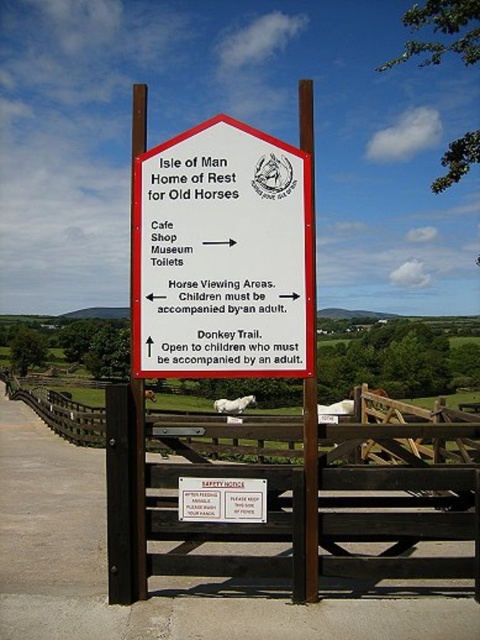
Can you confirm if white paper sign at center is positioned below white plastic sign at center?

No.

Which is in front, point (302, 307) or point (182, 516)?

Point (302, 307)

Where is `white paper sign at center`? white paper sign at center is located at coordinates (222, 256).

Consider the image. Is white paper sign at center to the right of wooden fence at center from the viewer's perspective?

Yes, white paper sign at center is to the right of wooden fence at center.

Can you confirm if white paper sign at center is thinner than wooden fence at center?

Correct, white paper sign at center's width is less than wooden fence at center's.

Between point (257, 177) and point (235, 593), which one is positioned behind?

The point (235, 593) is more distant.

Where is `white paper sign at center`? This screenshot has width=480, height=640. white paper sign at center is located at coordinates (222, 256).

Is white paper sign at center smaller than white wood post at center?

Indeed, white paper sign at center has a smaller size compared to white wood post at center.

Who is more distant from viewer, (307,292) or (311,509)?

The point (307,292) is more distant.

The height and width of the screenshot is (640, 480). I want to click on white paper sign at center, so click(x=222, y=256).